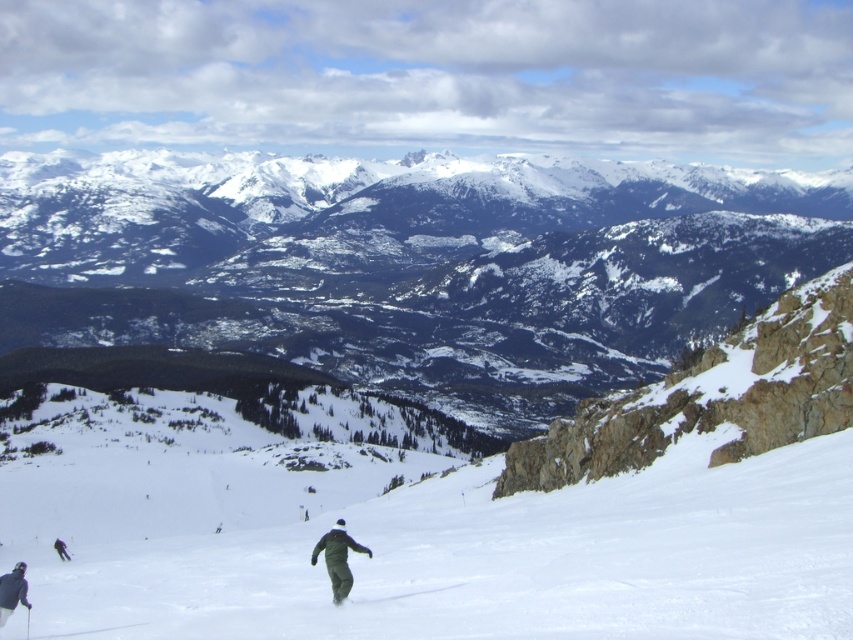
Between dark gray snowsuit at lower left and green matte ski at center, which one appears on the right side from the viewer's perspective?

green matte ski at center

Who is shorter, dark gray snowsuit at lower left or green matte ski at center?

green matte ski at center

Who is more forward, (12, 595) or (344, 600)?

Point (344, 600) is more forward.

This screenshot has width=853, height=640. What are the coordinates of `dark gray snowsuit at lower left` in the screenshot? It's located at (12, 592).

Is the position of dark green fabric pants at center less distant than that of green matte ski at center?

No, dark green fabric pants at center is behind green matte ski at center.

Measure the distance between dark green fabric pants at center and camera.

dark green fabric pants at center is 47.57 meters from camera.

Does point (346, 564) come in front of point (335, 595)?

No, it is not.

This screenshot has width=853, height=640. Identify the location of dark green fabric pants at center. (337, 557).

Can you confirm if white snow ski slope at center is positioned above dark gray snowsuit at lower left?

Correct, white snow ski slope at center is located above dark gray snowsuit at lower left.

Does white snow ski slope at center have a lesser height compared to dark gray snowsuit at lower left?

No.

Locate an element on the screen. white snow ski slope at center is located at coordinates (456, 552).